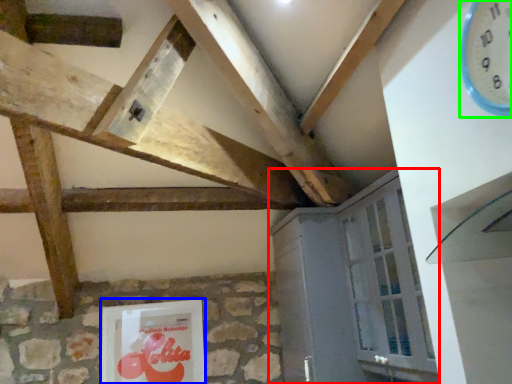
Question: Estimate the real-world distances between objects in this image. Which object is closer to cabinetry (highlighted by a red box), picture frame (highlighted by a blue box) or clock (highlighted by a green box)?

Choices:
 (A) picture frame
 (B) clock

Answer: (A)